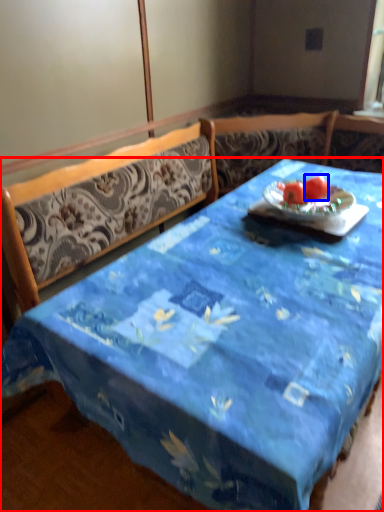
Question: Which of the following is the closest to the observer, desk (highlighted by a red box) or tomato (highlighted by a blue box)?

Choices:
 (A) desk
 (B) tomato

Answer: (A)